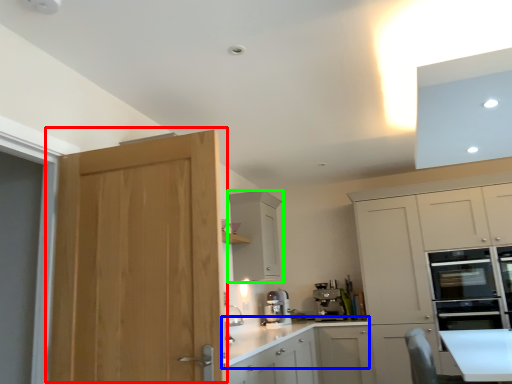
Question: Which is nearer to the door (highlighted by a red box)? countertop (highlighted by a blue box) or cabinetry (highlighted by a green box).

Choices:
 (A) countertop
 (B) cabinetry

Answer: (A)